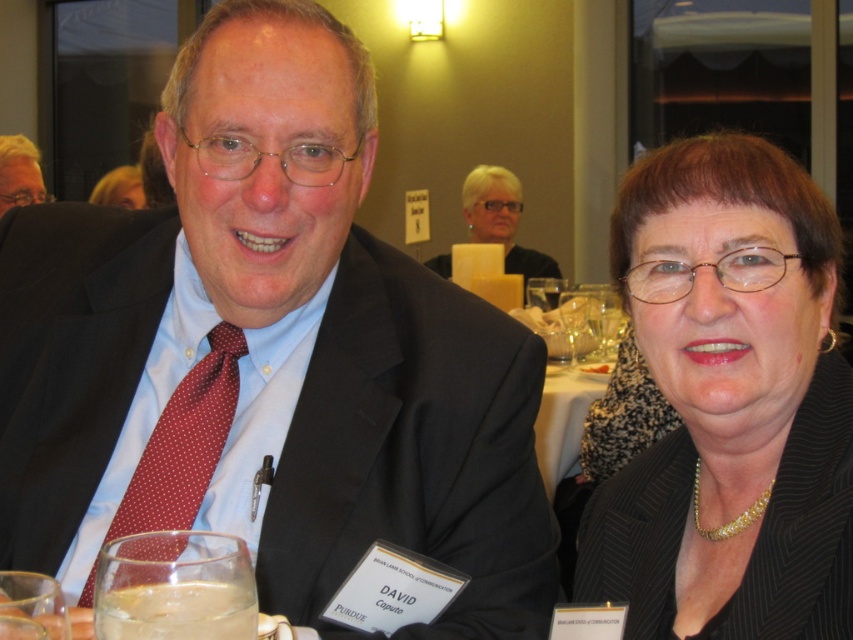
Question: Is the position of clear glass at lower left less distant than that of red dotted tie at left?

Choices:
 (A) no
 (B) yes

Answer: (B)

Question: Which object appears closest to the camera in this image?

Choices:
 (A) matte black jacket at upper center
 (B) clear glass at lower left
 (C) matte black suit at center
 (D) blonde hair at upper left

Answer: (B)

Question: Considering the real-world distances, which object is farthest from the matte black suit at center?

Choices:
 (A) black textured blazer at center
 (B) clear glass at lower left

Answer: (B)

Question: Among these points, which one is farthest from the camera?

Choices:
 (A) (180, 474)
 (B) (511, 257)

Answer: (B)

Question: Is matte black suit at center below blonde hair at upper left?

Choices:
 (A) no
 (B) yes

Answer: (B)

Question: Can you confirm if clear glass at lower left is smaller than red dotted tie at left?

Choices:
 (A) no
 (B) yes

Answer: (B)